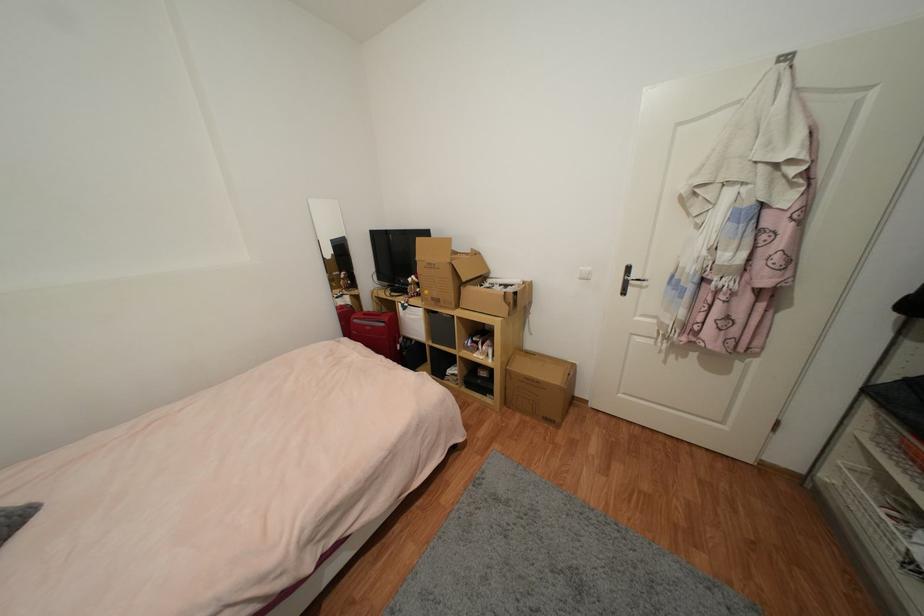
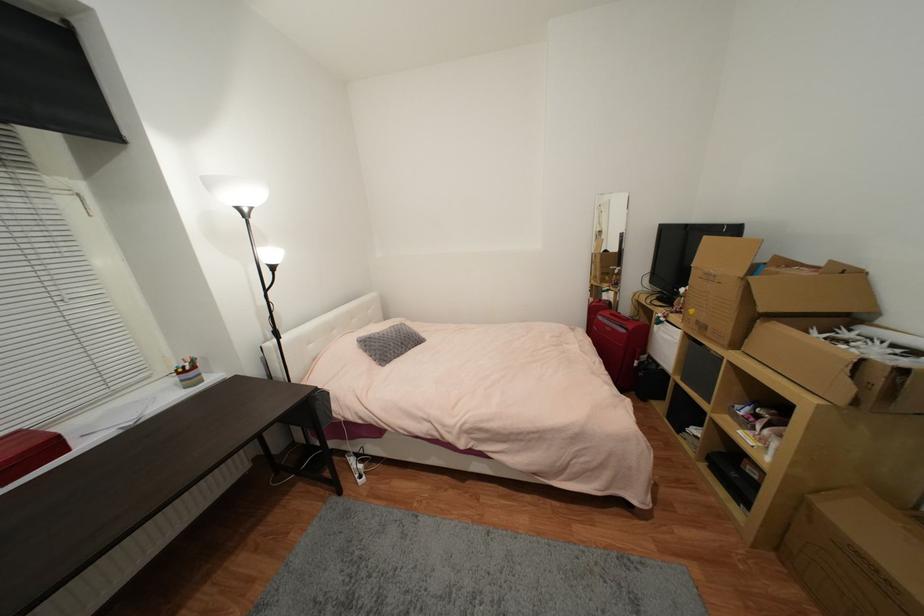
The point at (x=509, y=310) is marked in the first image. Where is the corresponding point in the second image?

(852, 390)